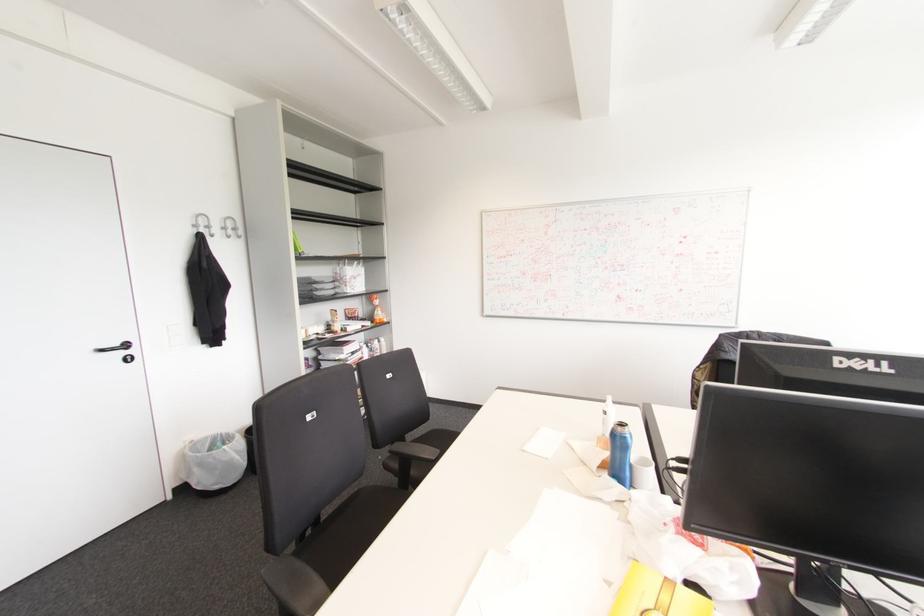
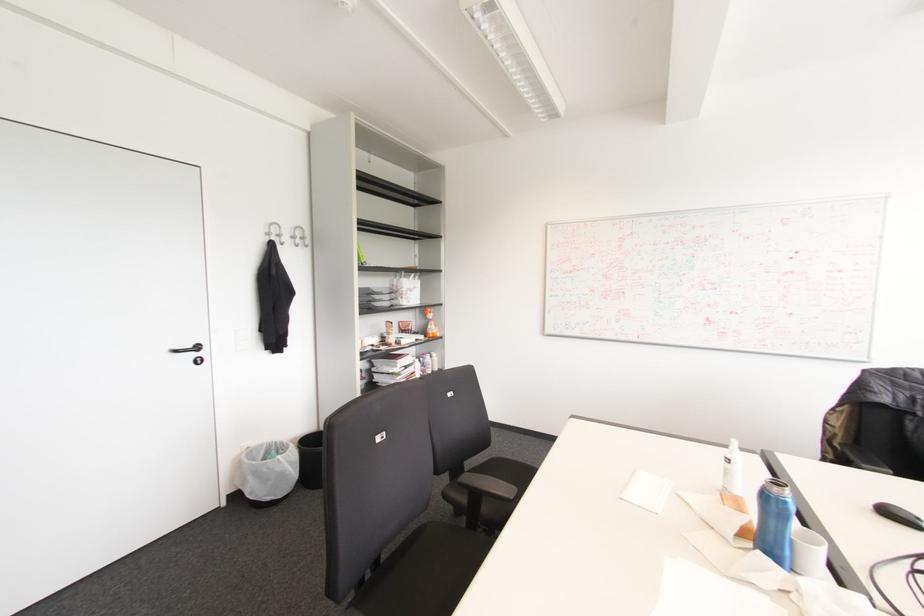
Find the pixel in the second image that matches the point at 604,411 in the first image.

(727, 460)